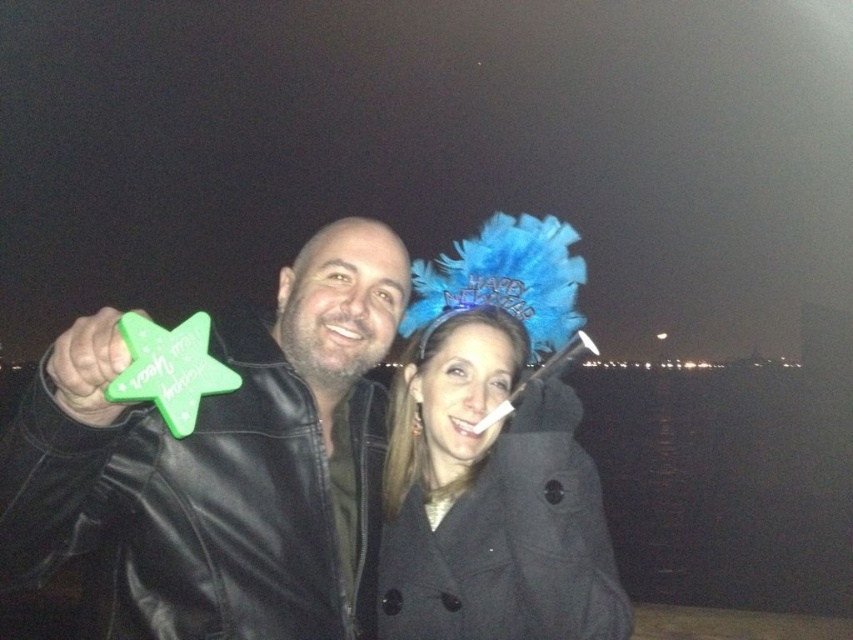
In the scene shown: Is green matte star at left to the left of black wool coat at center from the viewer's perspective?

Indeed, green matte star at left is positioned on the left side of black wool coat at center.

Between green matte star at left and black wool coat at center, which one appears on the left side from the viewer's perspective?

Positioned to the left is green matte star at left.

Is point (312, 502) closer to viewer compared to point (428, 636)?

Yes, it is in front of point (428, 636).

You are a GUI agent. You are given a task and a screenshot of the screen. Output one action in this format:
    pyautogui.click(x=<x>, y=<y>)
    Task: Click on the green matte star at left
    This screenshot has width=853, height=640.
    Given the screenshot: What is the action you would take?
    pyautogui.click(x=221, y=464)